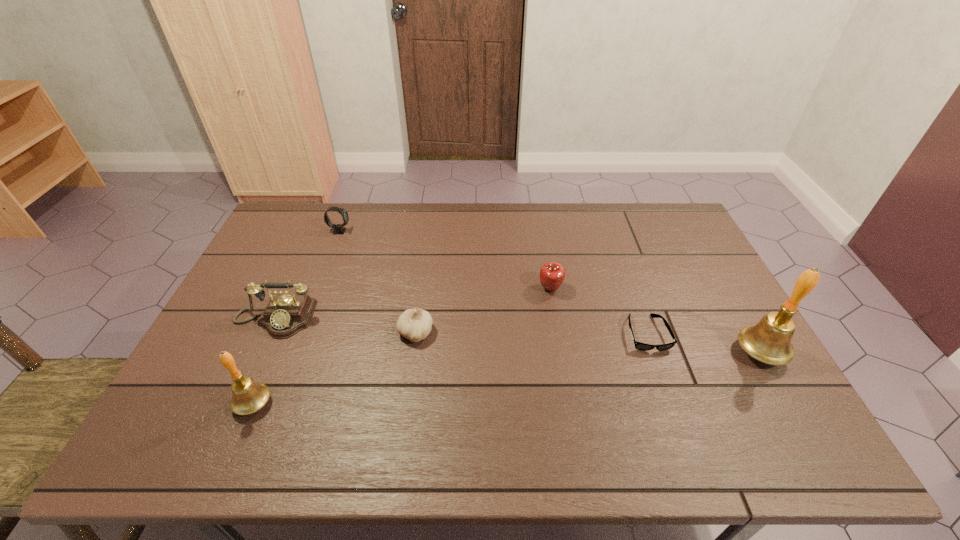
Where is `telephone positioned at the left edge`? telephone positioned at the left edge is located at coordinates (286, 314).

Locate an element on the screen. This screenshot has width=960, height=540. object that is at the right edge is located at coordinates (769, 341).

In order to click on object at the near left corner in this screenshot , I will do `click(249, 396)`.

This screenshot has width=960, height=540. In order to click on free space at the far edge of the desktop in this screenshot , I will do `click(575, 238)`.

In order to click on vacant space at the near edge of the desktop in this screenshot , I will do `click(584, 388)`.

I want to click on blank space at the left edge of the desktop, so point(263,247).

Find the location of a particular element. The width and height of the screenshot is (960, 540). free region at the far right corner of the desktop is located at coordinates (686, 235).

What are the coordinates of `empty space that is in between the watch and the second object from right to left` in the screenshot? It's located at (493, 282).

This screenshot has height=540, width=960. I want to click on vacant space that is in between the apple and the shortest object, so click(598, 311).

I want to click on free space between the sixth object from left to right and the fourth object from left to right, so click(x=531, y=333).